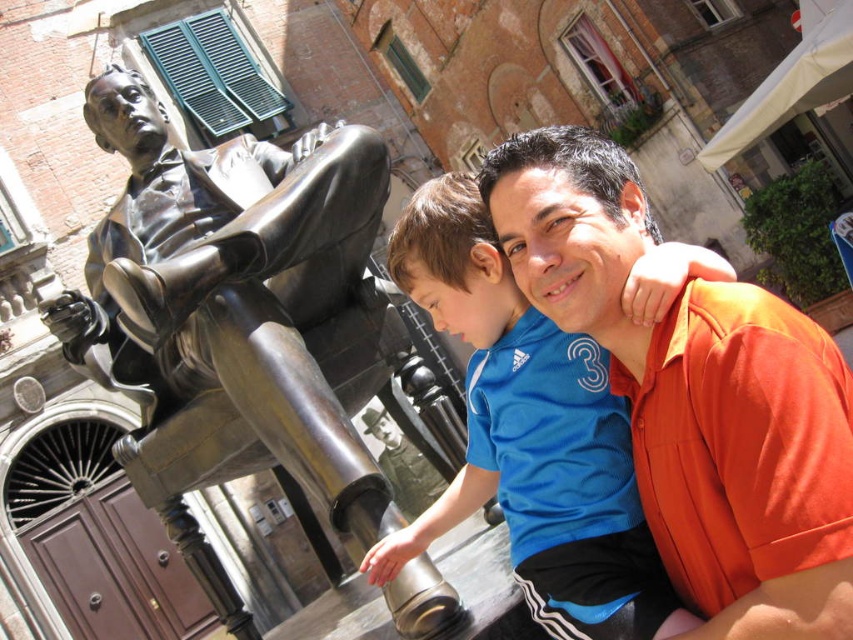
Question: Is bronze statue at left thinner than orange cotton shirt at upper right?

Choices:
 (A) no
 (B) yes

Answer: (A)

Question: Does bronze statue at left appear on the right side of orange cotton shirt at upper right?

Choices:
 (A) yes
 (B) no

Answer: (B)

Question: Is orange cotton shirt at upper right below blue jersey at center?

Choices:
 (A) yes
 (B) no

Answer: (B)

Question: Based on their relative distances, which object is farther from the blue jersey at center?

Choices:
 (A) bronze statue at left
 (B) orange cotton shirt at upper right

Answer: (A)

Question: Which point is closer to the camera?

Choices:
 (A) (256, 316)
 (B) (448, 509)

Answer: (A)

Question: Which point is closer to the camera?

Choices:
 (A) blue jersey at center
 (B) orange cotton shirt at upper right

Answer: (B)